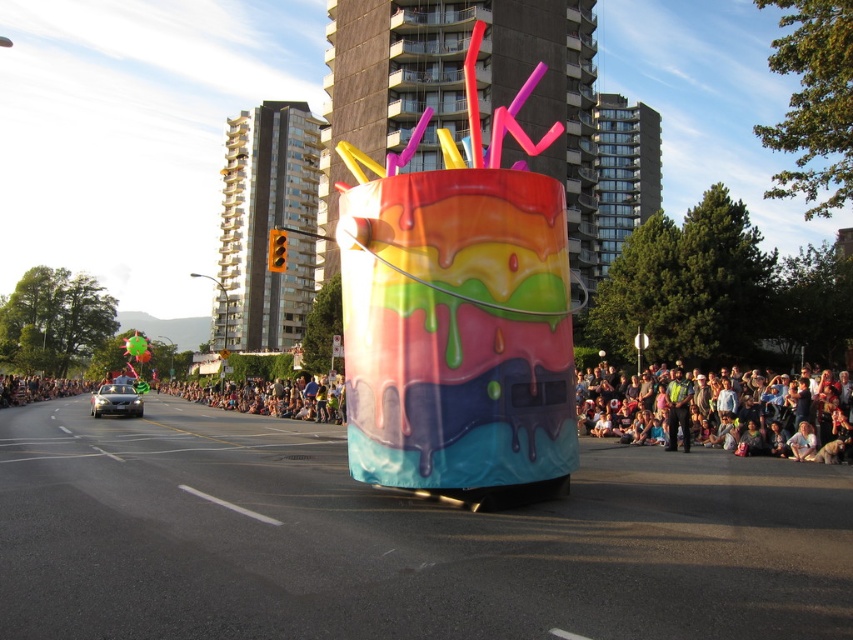
You are standing at the event and want to join the matte black crowd at lower right. Can you reach them within 10 seconds if you walk at a normal pace of 3 feet per second?

The distance between you and the matte black crowd at lower right is 47.58 feet. At a walking speed of 3 feet per second, it would take approximately 15.86 seconds to reach them, so you cannot reach them within 10 seconds.

Looking at this image, you are a photographer trying to capture a wide shot of the shiny black car at left and the matte black crowd at lower right. Which object will appear narrower in the photo?

The matte black crowd at lower right will appear narrower in the photo because its width is less than that of the shiny black car at left.